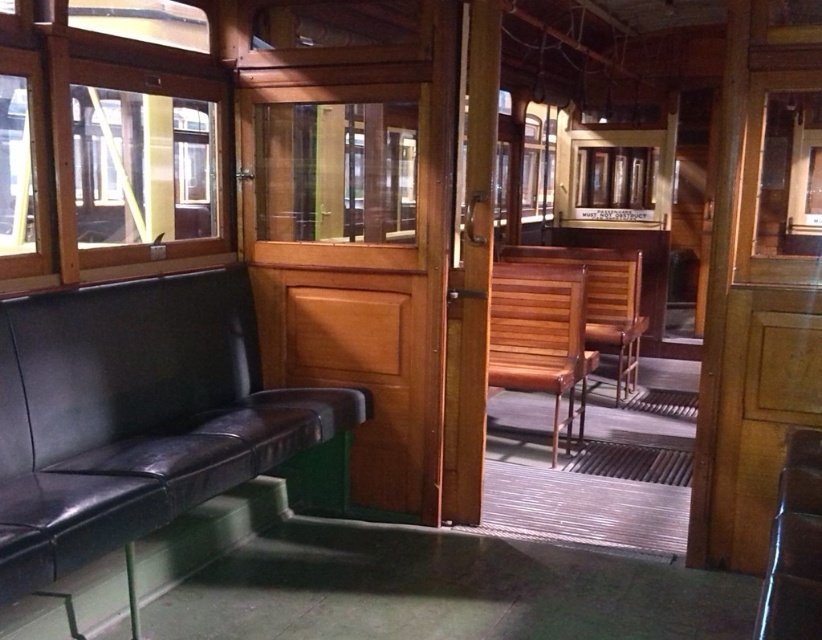
Question: Can you confirm if wooden chair at center is smaller than metallic silver chair at center?

Choices:
 (A) no
 (B) yes

Answer: (A)

Question: Does black leather couch at left lie behind wooden slats chair at center?

Choices:
 (A) yes
 (B) no

Answer: (B)

Question: Which point is farther from the camera taking this photo?

Choices:
 (A) (818, 608)
 (B) (547, 298)

Answer: (B)

Question: Which object appears closest to the camera in this image?

Choices:
 (A) wooden chair at center
 (B) black leather couch at left
 (C) wooden slats chair at center
 (D) metallic silver chair at center

Answer: (D)

Question: Which point is closer to the camera?

Choices:
 (A) metallic silver chair at center
 (B) wooden chair at center
 (C) wooden slats chair at center
 (D) black leather couch at left

Answer: (A)

Question: Does metallic silver chair at center have a smaller size compared to wooden slats chair at center?

Choices:
 (A) yes
 (B) no

Answer: (A)